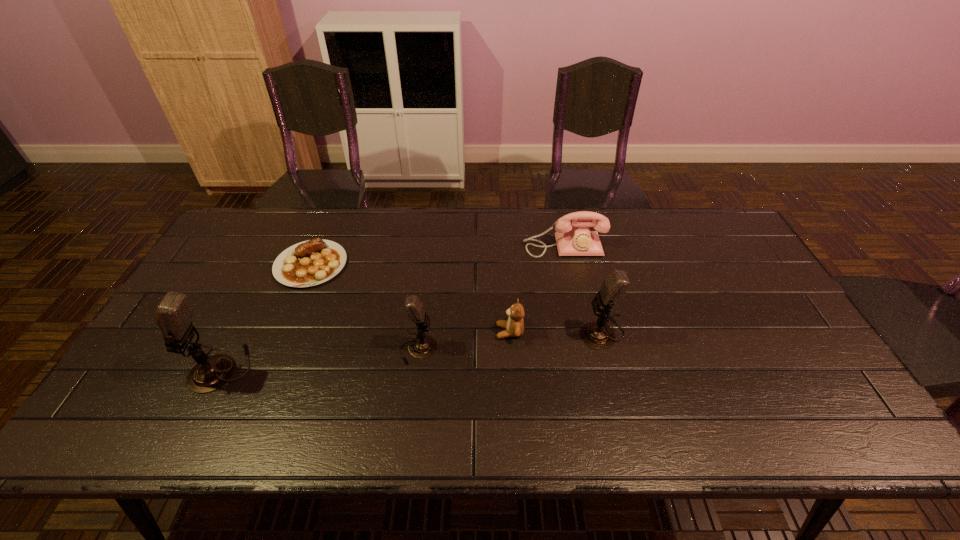
This screenshot has width=960, height=540. What are the coordinates of `the tallest microphone` in the screenshot? It's located at (x=174, y=314).

Locate an element on the screen. This screenshot has height=540, width=960. the leftmost microphone is located at coordinates (174, 314).

The image size is (960, 540). I want to click on the shortest microphone, so click(x=422, y=346).

Where is `the second microphone from left to right`? the second microphone from left to right is located at coordinates (422, 346).

Locate an element on the screen. The width and height of the screenshot is (960, 540). the fifth shortest object is located at coordinates (598, 335).

The width and height of the screenshot is (960, 540). Find the location of `the second tallest microphone`. the second tallest microphone is located at coordinates (598, 335).

At what (x,y) coordinates should I click in order to perform the action: click on steak. Please return your answer as a coordinate pair (x, y). Looking at the image, I should click on (312, 262).

Identify the location of teddy bear. (514, 326).

The image size is (960, 540). In order to click on the fifth tallest object in this screenshot , I will do `click(514, 326)`.

Where is `the third shortest object`? the third shortest object is located at coordinates (573, 237).